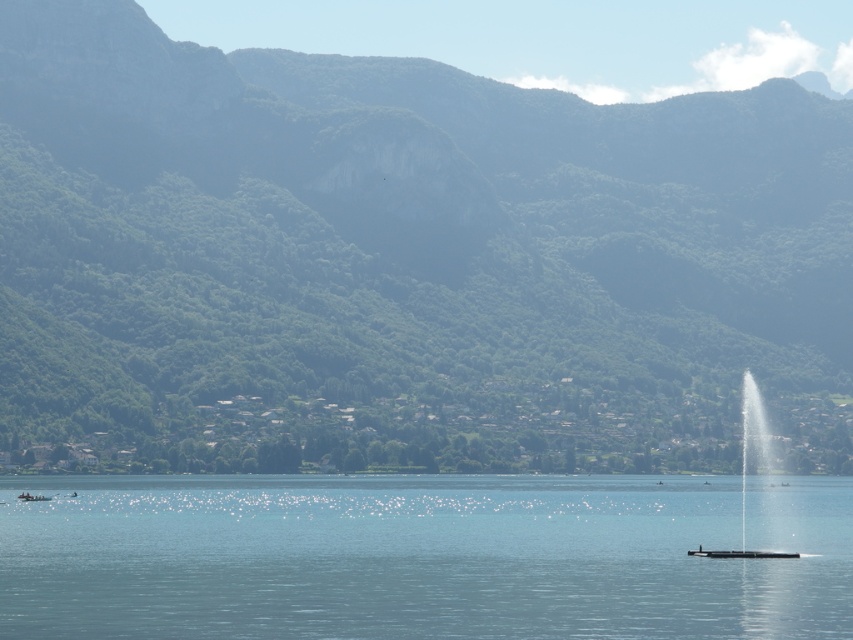
Can you confirm if green forested mountain at center is smaller than clear blue water at center?

Incorrect, green forested mountain at center is not smaller in size than clear blue water at center.

Does green forested mountain at center have a lesser height compared to clear blue water at center?

Incorrect, green forested mountain at center's height does not fall short of clear blue water at center's.

Between point (846, 177) and point (607, 602), which one is positioned in front?

Point (607, 602)

The height and width of the screenshot is (640, 853). I want to click on green forested mountain at center, so click(397, 257).

Does point (212, 604) lie behind point (759, 404)?

No.

Who is taller, clear blue water at center or clear glass fountain at center?

Standing taller between the two is clear glass fountain at center.

Who is more distant from viewer, [143,548] or [741,544]?

Point [741,544]

The width and height of the screenshot is (853, 640). Identify the location of clear blue water at center. (421, 557).

Which is below, clear glass fountain at center or white plastic boat at lower left?

white plastic boat at lower left is below.

Is point (764, 456) positioned before point (30, 493)?

No, (764, 456) is further to viewer.

What are the coordinates of `clear glass fountain at center` in the screenshot? It's located at (746, 468).